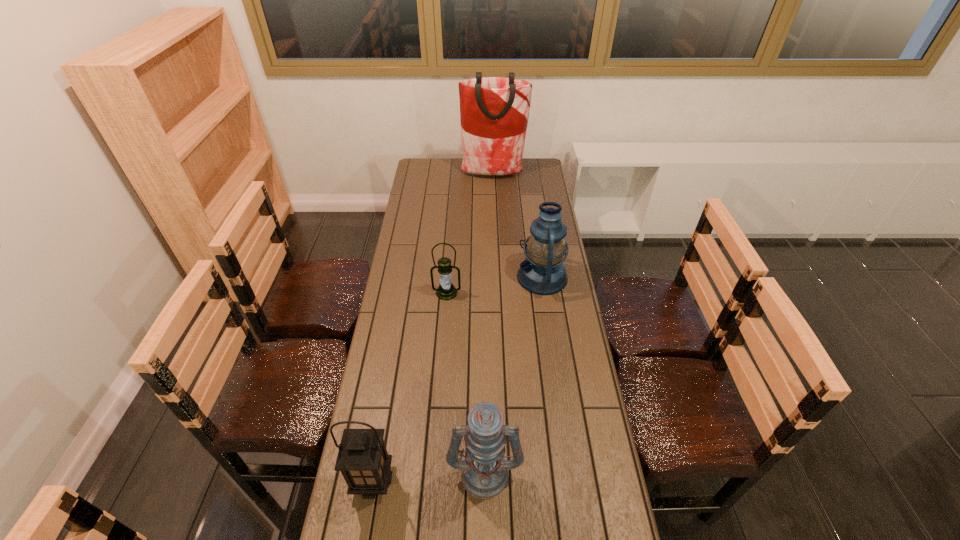
Where is `free region located 0.240m on the side where the shortest object emits light`? The height and width of the screenshot is (540, 960). free region located 0.240m on the side where the shortest object emits light is located at coordinates (443, 350).

At what (x,y) coordinates should I click in order to perform the action: click on object located at the far edge. Please return your answer as a coordinate pair (x, y). The width and height of the screenshot is (960, 540). Looking at the image, I should click on (494, 111).

At what (x,y) coordinates should I click in order to perform the action: click on object that is positioned at the left edge. Please return your answer as a coordinate pair (x, y). This screenshot has width=960, height=540. Looking at the image, I should click on (363, 460).

Identify the location of grocery bag present at the right edge. The height and width of the screenshot is (540, 960). (494, 111).

Where is `lantern positioned at the right edge`? The image size is (960, 540). lantern positioned at the right edge is located at coordinates (542, 272).

Find the location of a particular element. This screenshot has width=960, height=540. object that is at the far right corner is located at coordinates (494, 111).

Find the location of a particular element. Image resolution: width=960 pixels, height=540 pixels. vacant area at the left edge of the desktop is located at coordinates (398, 367).

Identify the location of blank area at the right edge. The image size is (960, 540). click(603, 457).

The width and height of the screenshot is (960, 540). Identify the location of free location at the far right corner. (525, 166).

Locate an element on the screen. This screenshot has height=540, width=960. free spot between the rightmost lantern and the farthest object is located at coordinates (517, 226).